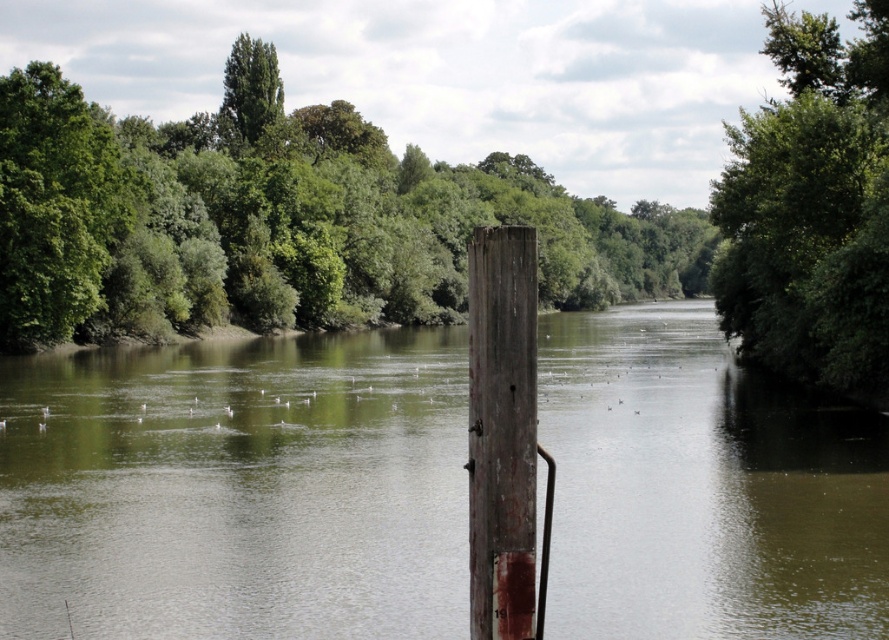
You are an observer looking at the serene river scene. You notice two green leafy trees in the image. Which tree is positioned higher up in the frame, the green leafy tree at center or the green leafy tree at upper right?

The green leafy tree at upper right is positioned higher up in the frame because the green leafy tree at center is located below it.